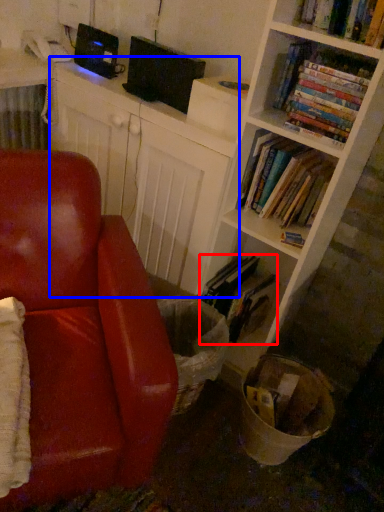
Question: Which point is closer to the camera, book (highlighted by a red box) or computer (highlighted by a blue box)?

Choices:
 (A) book
 (B) computer

Answer: (B)